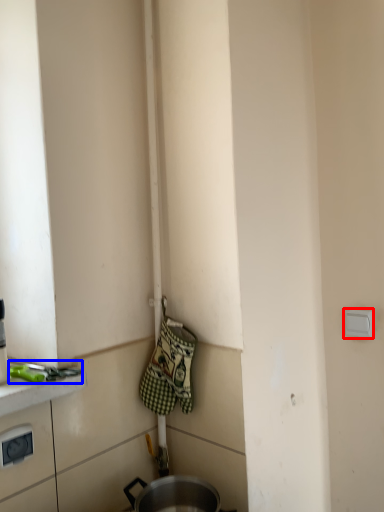
Question: Among these objects, which one is nearest to the camera, electric outlet (highlighted by a red box) or tool (highlighted by a blue box)?

Choices:
 (A) electric outlet
 (B) tool

Answer: (B)